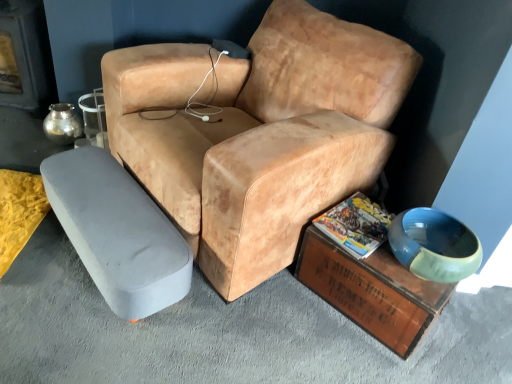
Image resolution: width=512 pixels, height=384 pixels. Find the location of `empty space that is ontop of gray fabric ottoman at lower left, which is the 2th table in right-to-left order (from a real-world perspective)`. empty space that is ontop of gray fabric ottoman at lower left, which is the 2th table in right-to-left order (from a real-world perspective) is located at coordinates (110, 201).